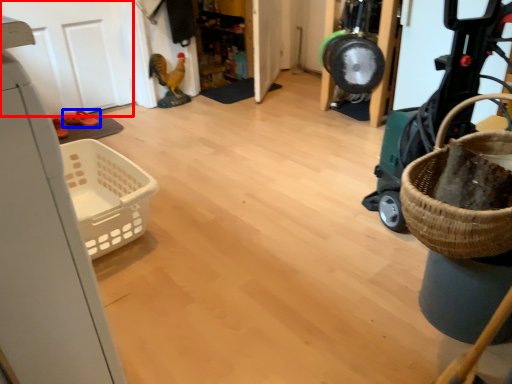
Question: Which object is closer to the camera taking this photo, door (highlighted by a red box) or footwear (highlighted by a blue box)?

Choices:
 (A) door
 (B) footwear

Answer: (A)